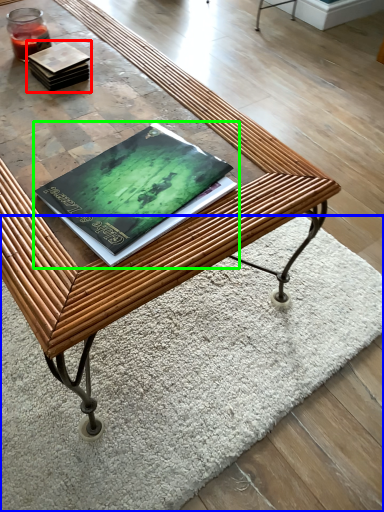
Question: Which is farther away from book (highlighted by a red box)? mat (highlighted by a blue box) or book (highlighted by a green box)?

Choices:
 (A) mat
 (B) book

Answer: (A)